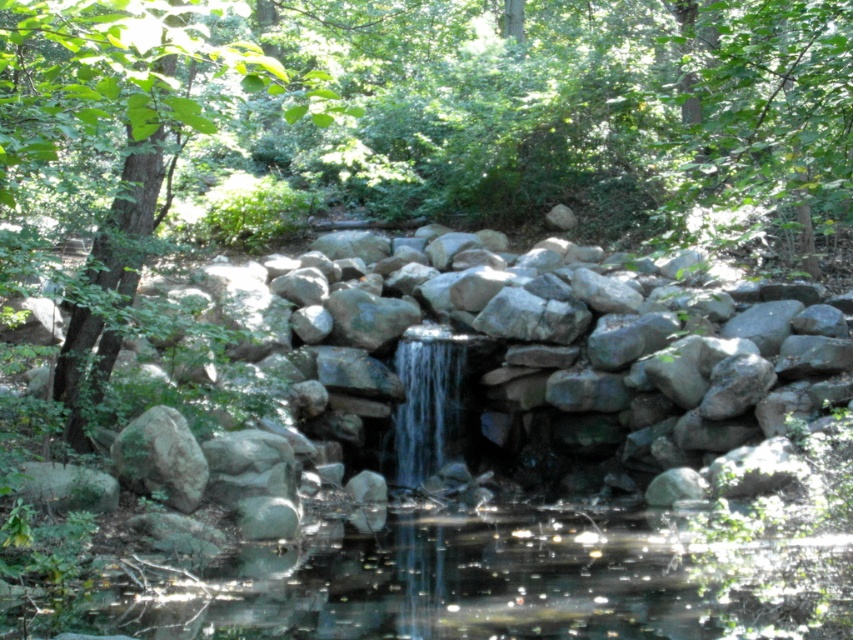
Does clear water at center have a greater height compared to green leafy tree at upper center?

Answer: In fact, clear water at center may be shorter than green leafy tree at upper center.

Can you confirm if clear water at center is wider than green leafy tree at upper center?

Incorrect, clear water at center's width does not surpass green leafy tree at upper center's.

Between point (177, 577) and point (776, 8), which one is positioned behind?

The point (177, 577) is behind.

Identify the location of clear water at center. (494, 582).